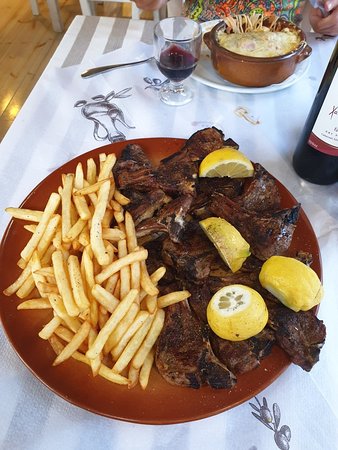
This screenshot has height=450, width=338. Identify the location of cup. (183, 47).